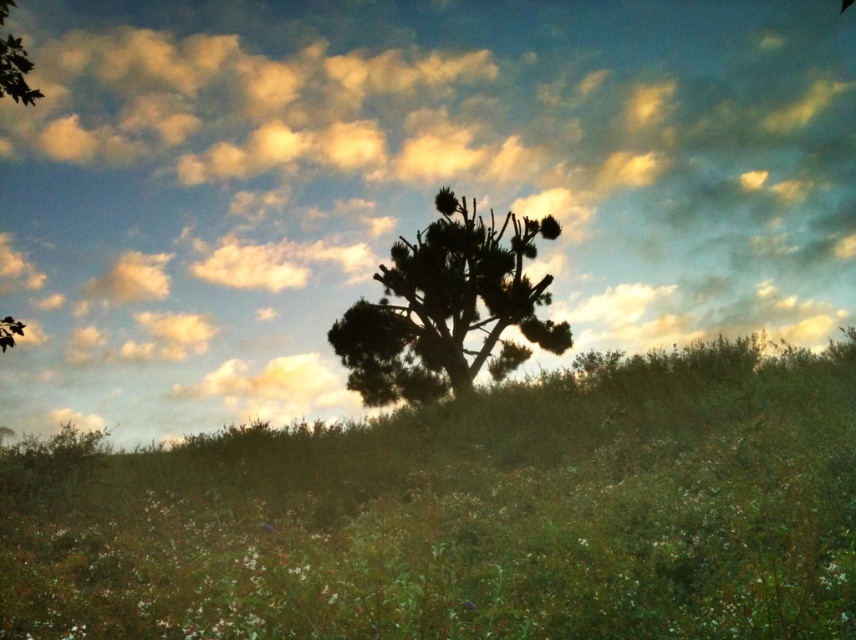
Question: Can you confirm if green grassy hillside at center is bigger than silhouette/branchy tree at center?

Choices:
 (A) no
 (B) yes

Answer: (B)

Question: Is green grassy hillside at center positioned in front of silhouette/branchy tree at center?

Choices:
 (A) yes
 (B) no

Answer: (A)

Question: Which point is closer to the camera taking this photo?

Choices:
 (A) click(x=506, y=304)
 (B) click(x=302, y=83)

Answer: (A)

Question: Which point is farther to the camera?

Choices:
 (A) (845, 148)
 (B) (846, 625)
 (C) (419, 289)

Answer: (A)

Question: Can you confirm if cloudy sky at upper center is positioned to the right of silhouette/branchy tree at center?

Choices:
 (A) no
 (B) yes

Answer: (B)

Question: Which of the following is the closest to the observer?

Choices:
 (A) click(x=443, y=358)
 (B) click(x=236, y=132)

Answer: (A)